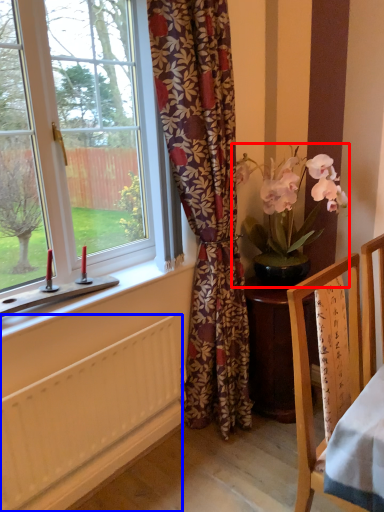
Question: Which of the following is the closest to the observer, houseplant (highlighted by a red box) or radiator (highlighted by a blue box)?

Choices:
 (A) houseplant
 (B) radiator

Answer: (B)